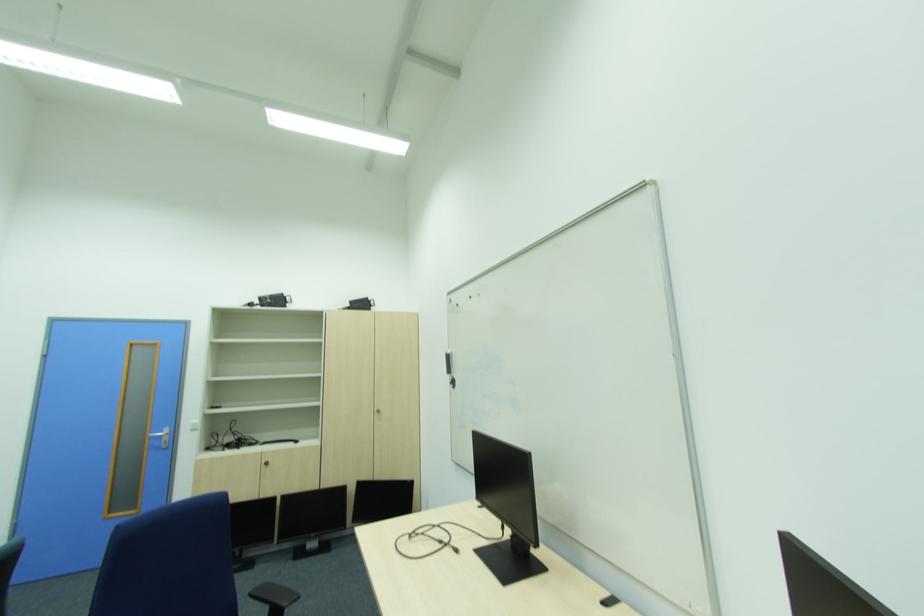
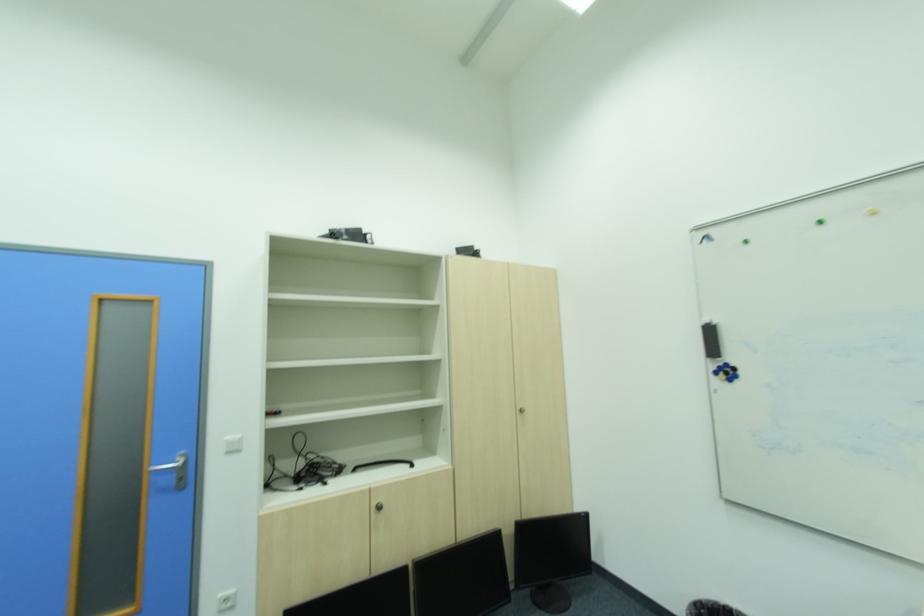
Locate, in the second image, the point that corresponds to point (369, 485) in the first image.

(531, 531)